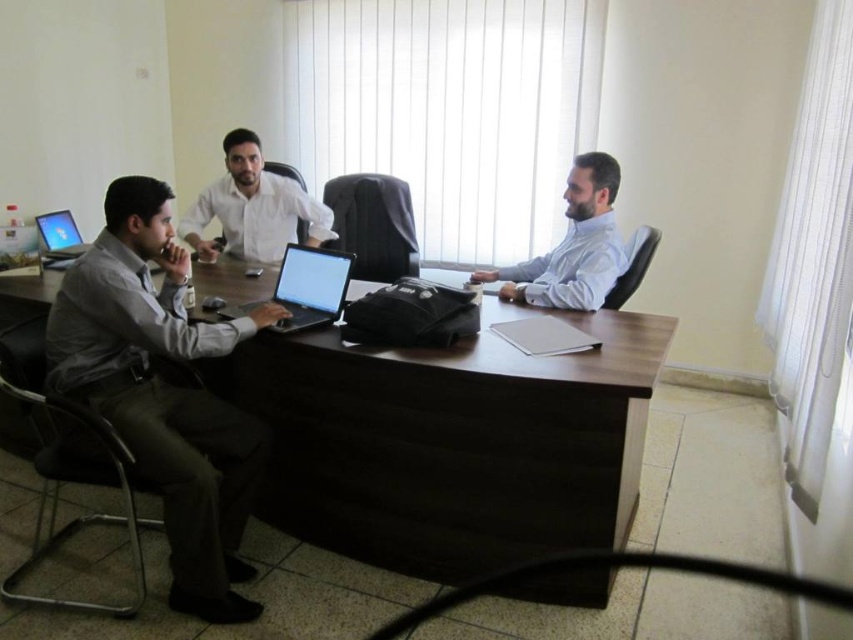
Between white glossy shirt at center and matte black laptop at left, which one appears on the right side from the viewer's perspective?

white glossy shirt at center

Which is below, white glossy shirt at center or matte black laptop at left?

matte black laptop at left is lower down.

At what (x,y) coordinates should I click in order to perform the action: click on white glossy shirt at center. Please return your answer as a coordinate pair (x, y). This screenshot has width=853, height=640. Looking at the image, I should click on (253, 208).

Does dark wood table at center have a greater height compared to light blue shirt at right?

Correct, dark wood table at center is much taller as light blue shirt at right.

You are a GUI agent. You are given a task and a screenshot of the screen. Output one action in this format:
    pyautogui.click(x=<x>, y=<y>)
    Task: Click on the dark wood table at center
    This screenshot has width=853, height=640.
    Given the screenshot: What is the action you would take?
    pyautogui.click(x=453, y=440)

Locate an element on the screen. dark wood table at center is located at coordinates (453, 440).

Is dark wood table at center to the left of matte gray shirt at left from the viewer's perspective?

Incorrect, dark wood table at center is not on the left side of matte gray shirt at left.

Is dark wood table at center smaller than matte gray shirt at left?

No, dark wood table at center is not smaller than matte gray shirt at left.

The width and height of the screenshot is (853, 640). What do you see at coordinates (453, 440) in the screenshot?
I see `dark wood table at center` at bounding box center [453, 440].

Where is `dark wood table at center`? dark wood table at center is located at coordinates (453, 440).